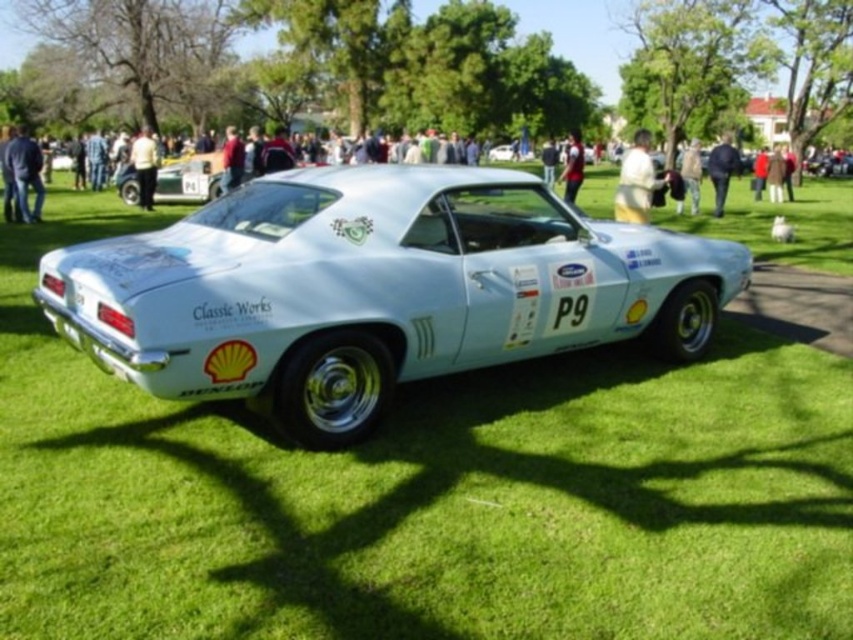
Question: Among these points, which one is farthest from the camera?

Choices:
 (A) (579, 179)
 (B) (688, 177)

Answer: (B)

Question: Does white fabric shirt at upper center appear on the left side of red sweater at upper center?

Choices:
 (A) no
 (B) yes

Answer: (A)

Question: Among these points, which one is farthest from the camera?

Choices:
 (A) [480, 264]
 (B) [712, 168]

Answer: (B)

Question: From the image, what is the correct spatial relationship of light blue metallic sports car at center in relation to white shirt at center?

Choices:
 (A) below
 (B) above

Answer: (A)

Question: Is light blue metallic sports car at center wider than camouflage pants at center?

Choices:
 (A) yes
 (B) no

Answer: (B)

Question: Which of the following is the closest to the observer?

Choices:
 (A) white shirt at center
 (B) dark blue jacket at center

Answer: (A)